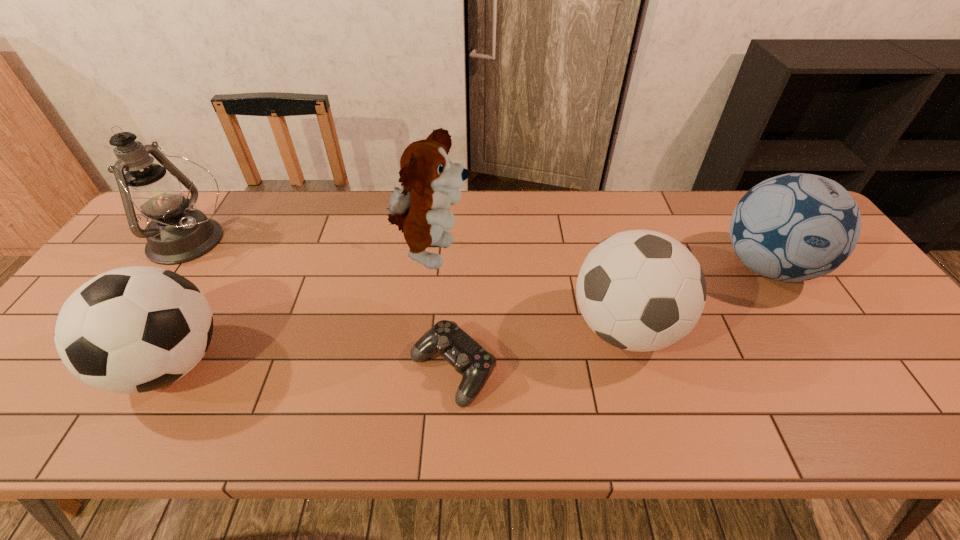
The height and width of the screenshot is (540, 960). I want to click on vacant space situated 0.180m on the left of the leftmost soccer ball, so click(36, 364).

This screenshot has width=960, height=540. I want to click on free space located 0.230m on the back of the control, so click(458, 268).

Image resolution: width=960 pixels, height=540 pixels. What are the coordinates of `oil lamp located at the far edge` in the screenshot? It's located at (178, 233).

Locate an element on the screen. This screenshot has width=960, height=540. puppy present at the far edge is located at coordinates (431, 181).

You are a GUI agent. You are given a task and a screenshot of the screen. Output one action in this format:
    pyautogui.click(x=<x>, y=<y>)
    Task: Click on the soccer ball positioned at the far edge
    The width and height of the screenshot is (960, 540).
    Given the screenshot: What is the action you would take?
    pyautogui.click(x=794, y=227)

What are the coordinates of `soccer ball present at the near edge` in the screenshot? It's located at (136, 329).

Image resolution: width=960 pixels, height=540 pixels. In order to click on control situated at the near edge in this screenshot , I will do `click(475, 364)`.

Identify the location of object located at the left edge. (178, 233).

Find the location of `object present at the right edge`. object present at the right edge is located at coordinates (794, 227).

The image size is (960, 540). I want to click on object present at the far left corner, so [x=178, y=233].